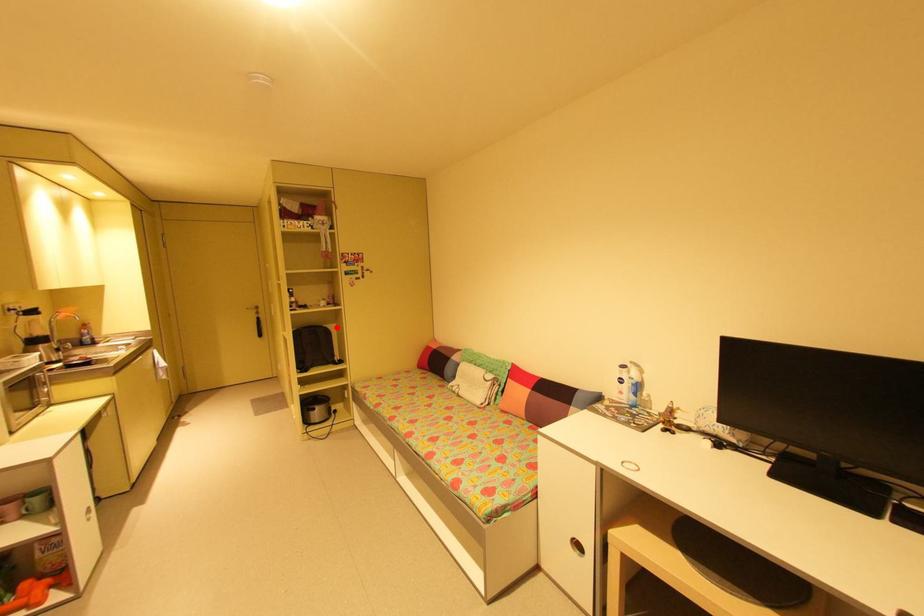
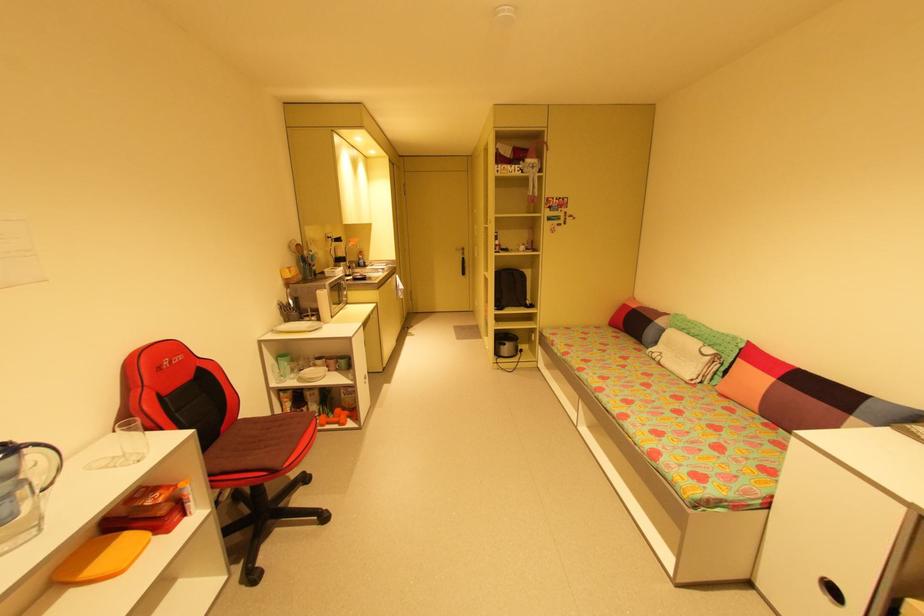
Question: A red point is marked in image1. In image2, is the corresponding 3D point closer to the camera or farther? Reply with the corresponding letter.

Choices:
 (A) The corresponding 3D point is closer.
 (B) The corresponding 3D point is farther.

Answer: (A)